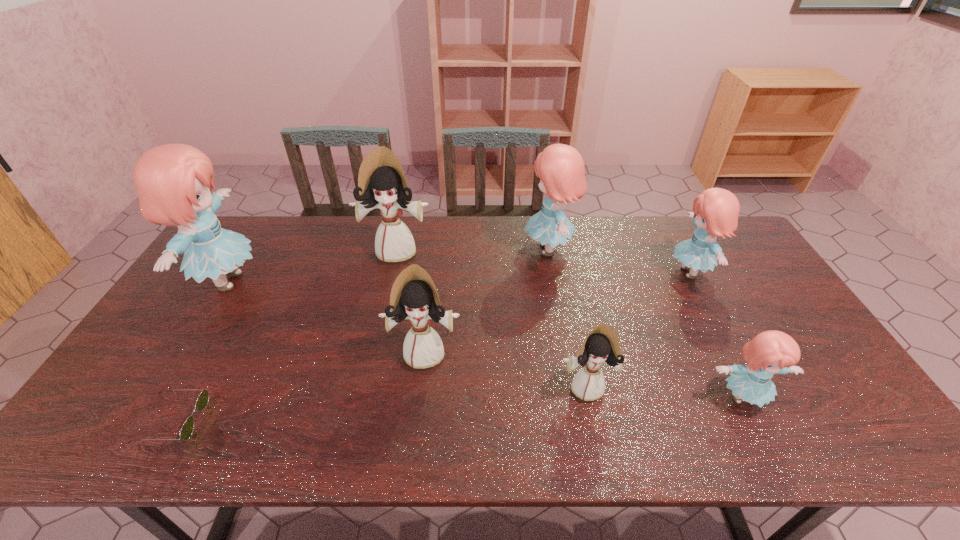
Where is `the tallest object`? The image size is (960, 540). the tallest object is located at coordinates (173, 181).

You are a GUI agent. You are given a task and a screenshot of the screen. Output one action in this format:
    pyautogui.click(x=<x>, y=<y>)
    Task: Click on the leftmost doll
    The height and width of the screenshot is (540, 960).
    Given the screenshot: What is the action you would take?
    pyautogui.click(x=173, y=181)

Find the location of `the second blue doll from left to right`. the second blue doll from left to right is located at coordinates (560, 167).

Where is `the biggest black doll`? the biggest black doll is located at coordinates (382, 184).

Identify the location of the second smallest blue doll. (716, 210).

I want to click on the second smallest black doll, so click(414, 296).

Find the location of a particular element. This screenshot has width=960, height=540. the smallest black doll is located at coordinates (602, 345).

The height and width of the screenshot is (540, 960). What are the coordinates of `the smallest blue doll` in the screenshot? It's located at (771, 352).

I want to click on green sunglasses, so click(x=187, y=429).

Find the location of a particular element. sunglasses is located at coordinates (187, 429).